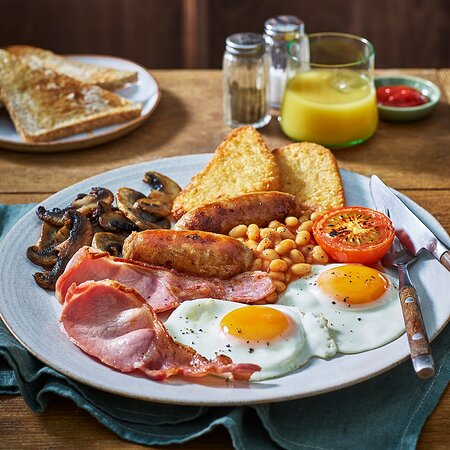
Find the location of a particular element. This screenshot has height=450, width=450. fork is located at coordinates (398, 250).